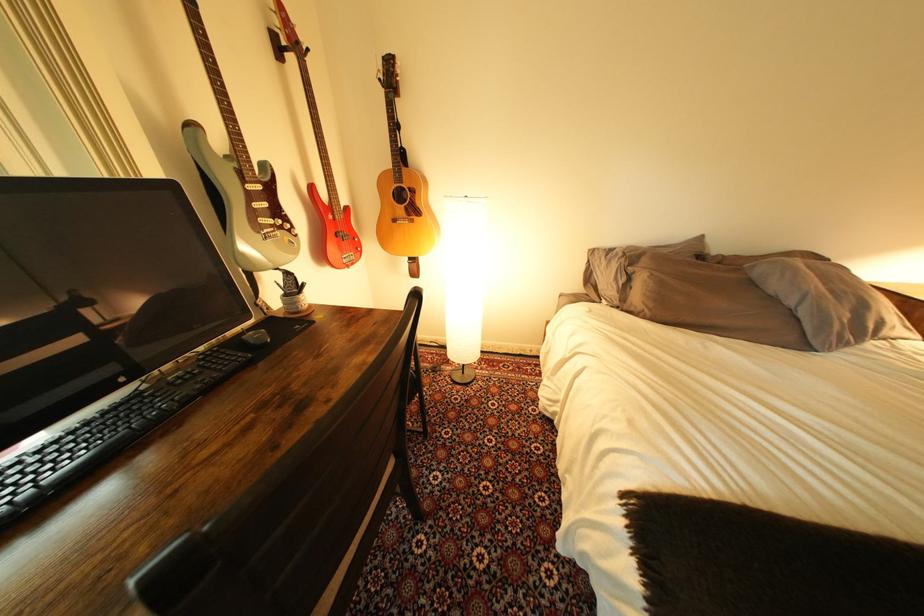
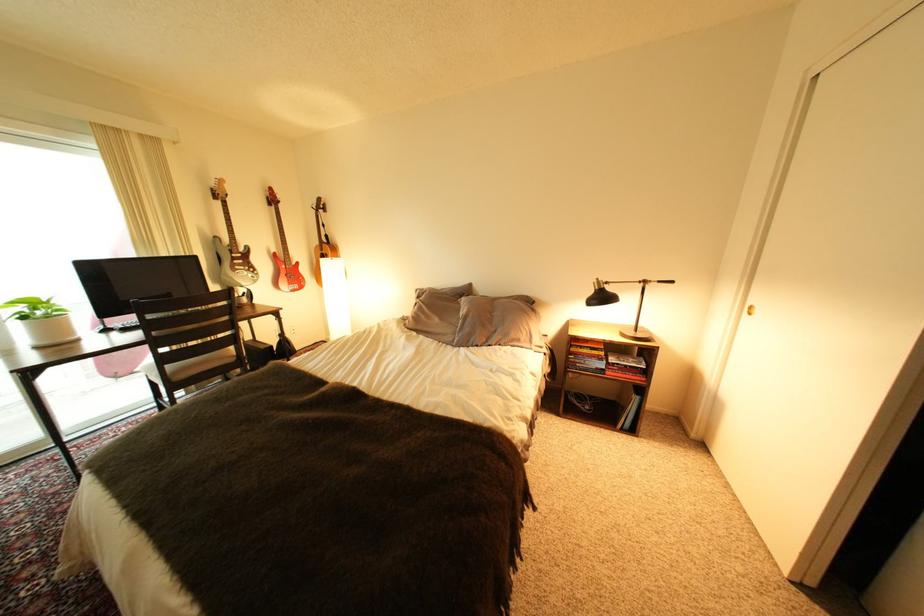
Question: I am providing you with two images of the same scene from different viewpoints. Please identify which objects are invisible in image2.

Choices:
 (A) silver electric guitar
 (B) black lamp shade
 (C) red electric guitar
 (D) none of these

Answer: (D)